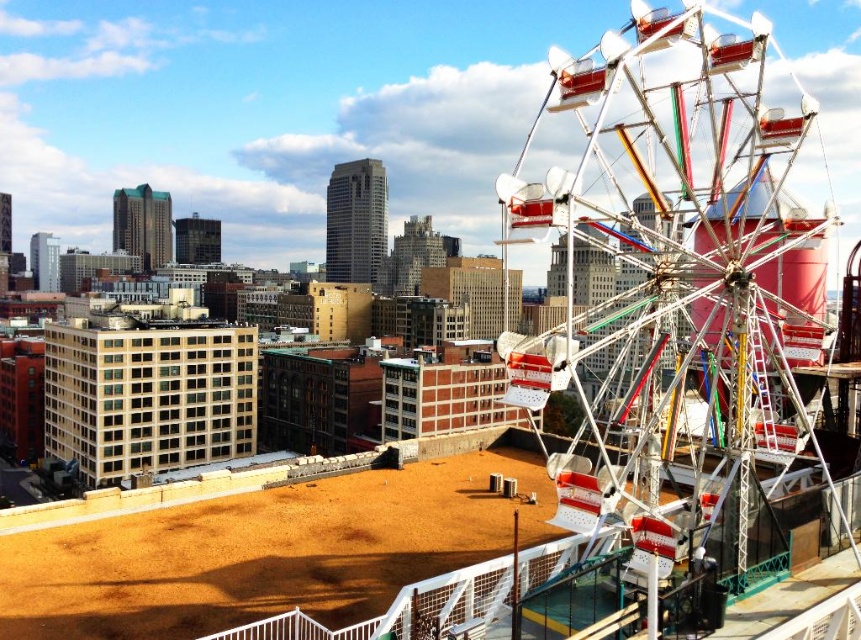
Question: In this image, where is metallic ferris wheel at right located relative to brown sandy dirt field at lower center?

Choices:
 (A) right
 (B) left

Answer: (A)

Question: Which of the following is the closest to the observer?

Choices:
 (A) metallic ferris wheel at right
 (B) brown sandy dirt field at lower center

Answer: (A)

Question: Which of the following is the farthest from the observer?

Choices:
 (A) (x=248, y=532)
 (B) (x=577, y=83)

Answer: (A)

Question: Can you confirm if metallic ferris wheel at right is positioned to the right of brown sandy dirt field at lower center?

Choices:
 (A) no
 (B) yes

Answer: (B)

Question: Is metallic ferris wheel at right to the left of brown sandy dirt field at lower center from the viewer's perspective?

Choices:
 (A) no
 (B) yes

Answer: (A)

Question: Which point appears closest to the camera in this image?

Choices:
 (A) (695, 20)
 (B) (246, 497)

Answer: (A)